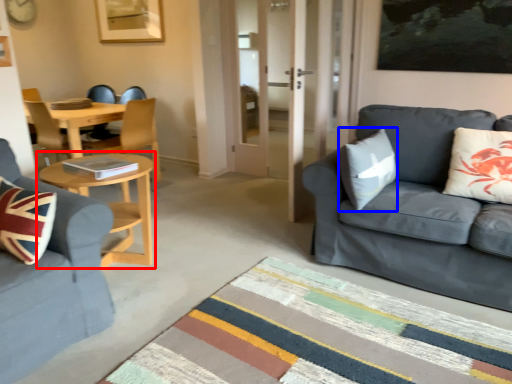
Question: Among these objects, which one is nearest to the camera, coffee table (highlighted by a red box) or pillow (highlighted by a blue box)?

Choices:
 (A) coffee table
 (B) pillow

Answer: (B)